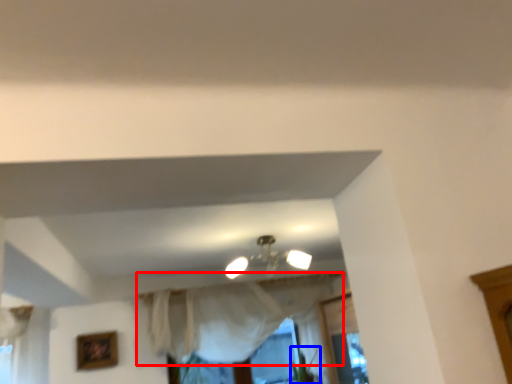
Question: Which object appears farthest to the camera in this image, curtain (highlighted by a red box) or plant (highlighted by a blue box)?

Choices:
 (A) curtain
 (B) plant

Answer: (B)